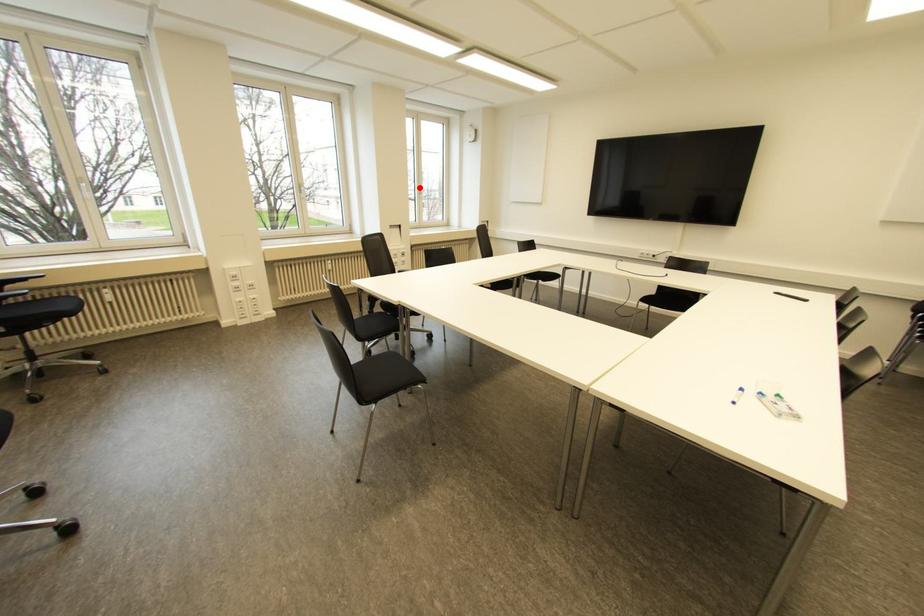
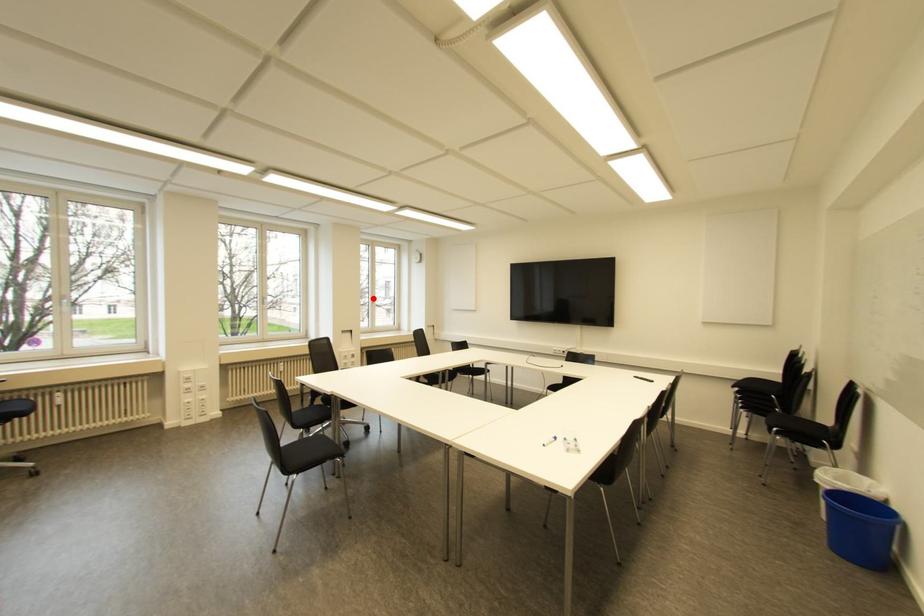
I am providing you with two images of the same scene from different viewpoints. A red point is marked on the first image and another point is marked on the second image. Is the marked point in image1 the same physical position as the marked point in image2?

Yes